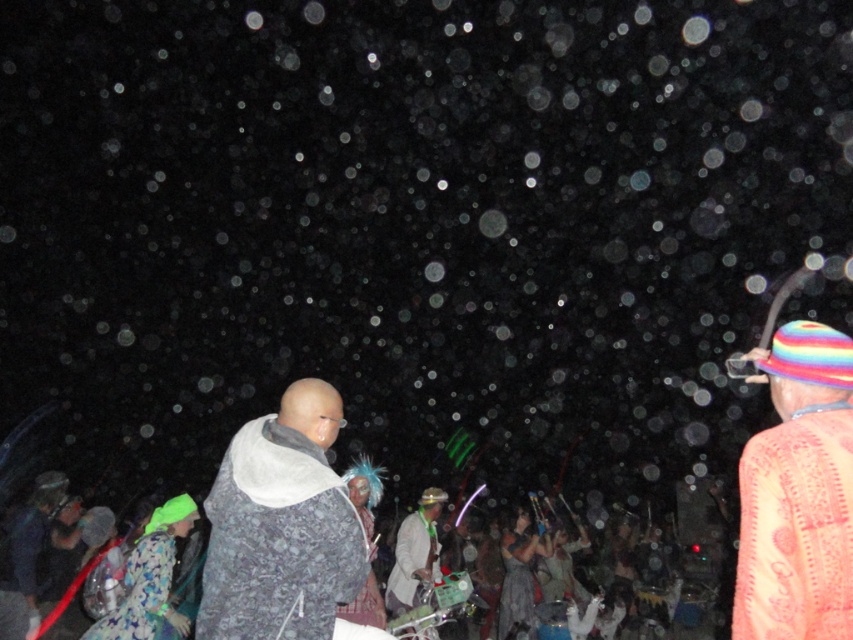
Question: Which point appears closest to the camera in this image?

Choices:
 (A) (782, 372)
 (B) (270, 516)
 (C) (389, 605)

Answer: (A)

Question: Is fluffy white scarf at center above multicolored fabric hat at right?

Choices:
 (A) yes
 (B) no

Answer: (B)

Question: Does fluffy white scarf at center appear on the left side of white textured jacket at center?

Choices:
 (A) yes
 (B) no

Answer: (A)

Question: Which of these objects is positioned closest to the fluffy white scarf at center?

Choices:
 (A) white textured jacket at center
 (B) multicolored fabric hat at right

Answer: (B)

Question: Which of the following is the farthest from the observer?

Choices:
 (A) (790, 406)
 (B) (310, 401)

Answer: (B)

Question: Is multicolored fabric hat at right above white textured jacket at center?

Choices:
 (A) yes
 (B) no

Answer: (A)